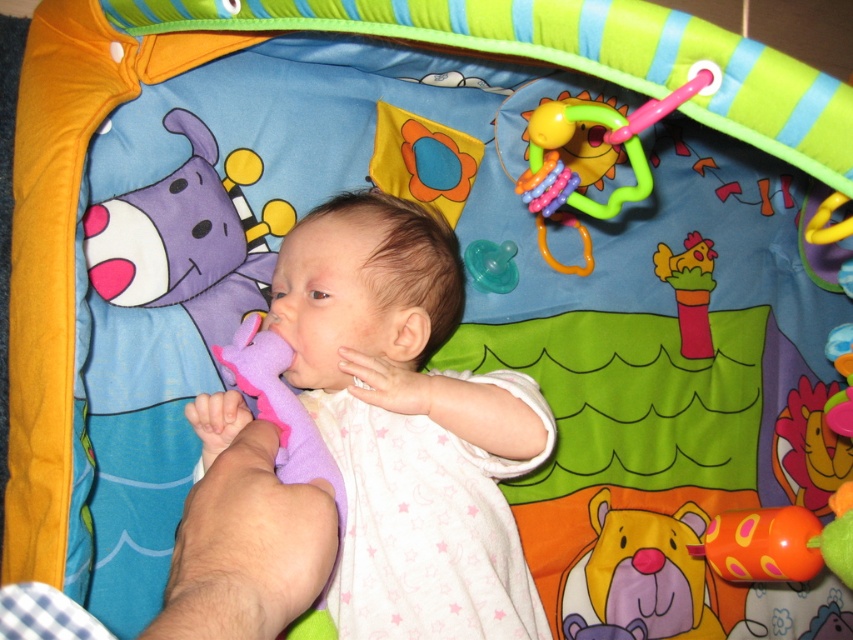
Image resolution: width=853 pixels, height=640 pixels. Find the location of `purple soft plush bear at center`. purple soft plush bear at center is located at coordinates (639, 577).

This screenshot has height=640, width=853. I want to click on purple soft plush bear at center, so click(x=639, y=577).

This screenshot has width=853, height=640. Describe the element at coordinates (762, 545) in the screenshot. I see `orange rubber teething ring at lower right` at that location.

Is orange rubber teething ring at lower right wider than pink rubber chicken at upper right?

Yes.

At what (x,y) coordinates should I click in order to perform the action: click on orange rubber teething ring at lower right. Please return your answer as a coordinate pair (x, y). Looking at the image, I should click on (762, 545).

At what (x,y) coordinates should I click in order to perform the action: click on orange rubber teething ring at lower right. Please return your answer as a coordinate pair (x, y). This screenshot has width=853, height=640. Looking at the image, I should click on (762, 545).

Does pink rubber teething ring at upper center appear under orange rubber teething ring at lower right?

Actually, pink rubber teething ring at upper center is above orange rubber teething ring at lower right.

Does pink rubber teething ring at upper center appear on the left side of orange rubber teething ring at lower right?

Correct, you'll find pink rubber teething ring at upper center to the left of orange rubber teething ring at lower right.

Describe the element at coordinates (606, 141) in the screenshot. I see `pink rubber teething ring at upper center` at that location.

Where is `pink rubber teething ring at upper center`? The height and width of the screenshot is (640, 853). pink rubber teething ring at upper center is located at coordinates (606, 141).